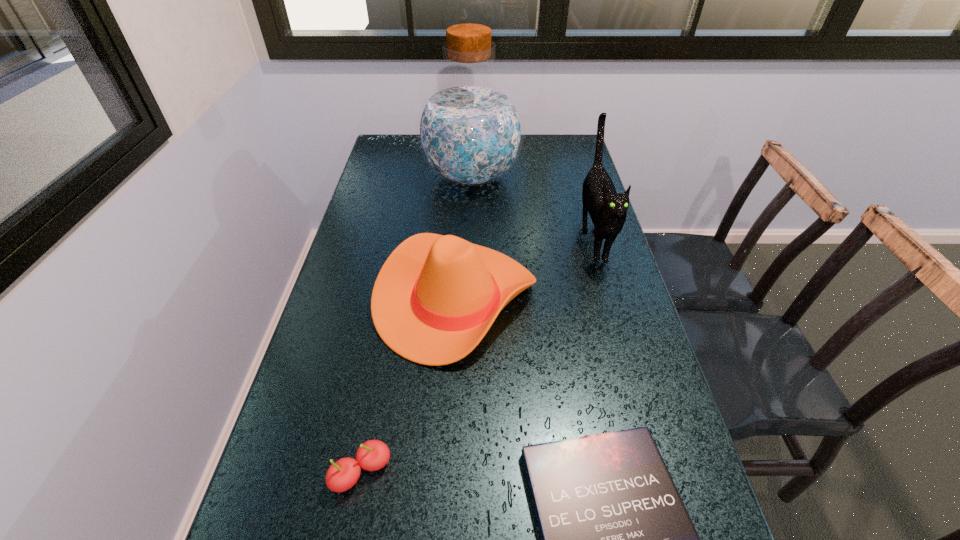
This screenshot has width=960, height=540. I want to click on free space between the tallest object and the fourth shortest object, so click(532, 208).

Locate an element on the screen. The width and height of the screenshot is (960, 540). vacant area that lies between the cowboy hat and the water jug is located at coordinates pyautogui.click(x=464, y=238).

Choose which object is the fourth nearest neighbor to the fourth tallest object. Please provide its 2D coordinates. Your answer should be formatted as a tuple, i.e. [(x, y)], where the tuple contains the x and y coordinates of a point satisfying the conditions above.

[(470, 131)]

At what (x,y) coordinates should I click in order to perform the action: click on the fourth closest object to the fourth tallest object. Please return your answer as a coordinate pair (x, y). The height and width of the screenshot is (540, 960). Looking at the image, I should click on (470, 131).